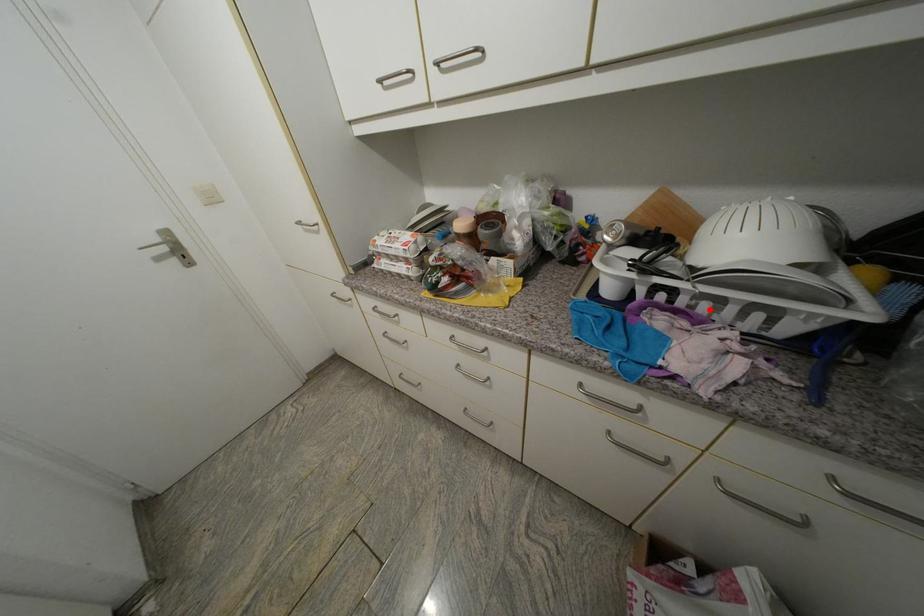
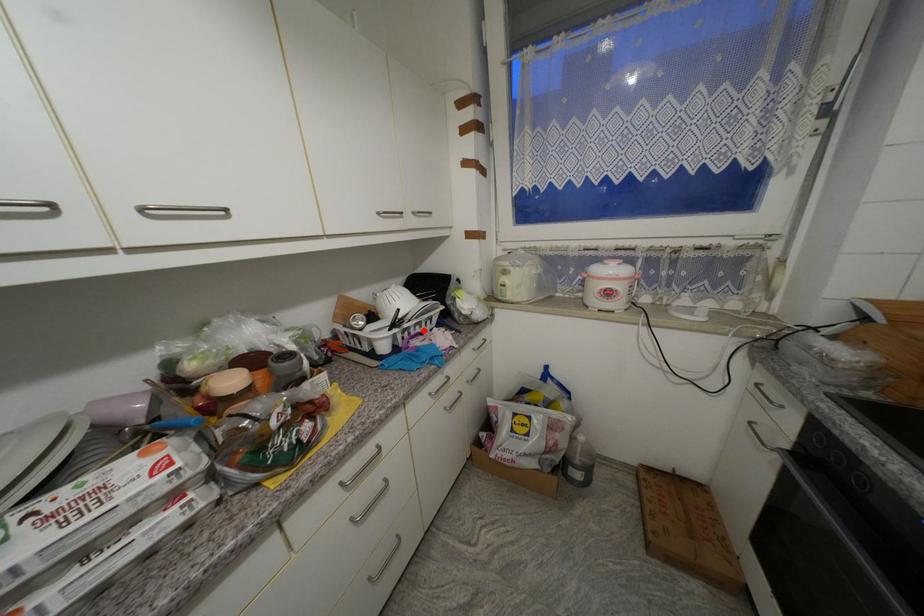
I am providing you with two images of the same scene from different viewpoints. A red point is marked on the first image and another point is marked on the second image. Does the point marked in image1 correspond to the same location as the one in image2?

Yes